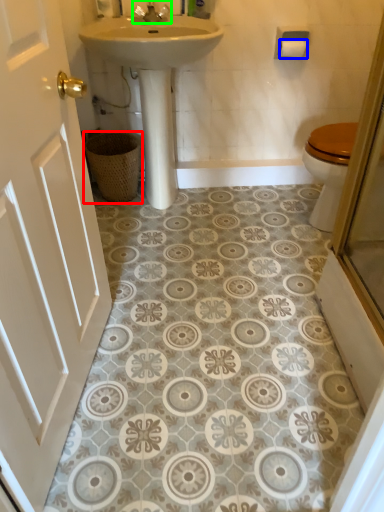
Question: Considering the real-world distances, which object is farthest from basket (highlighted by a red box)? toilet paper (highlighted by a blue box) or tap (highlighted by a green box)?

Choices:
 (A) toilet paper
 (B) tap

Answer: (A)